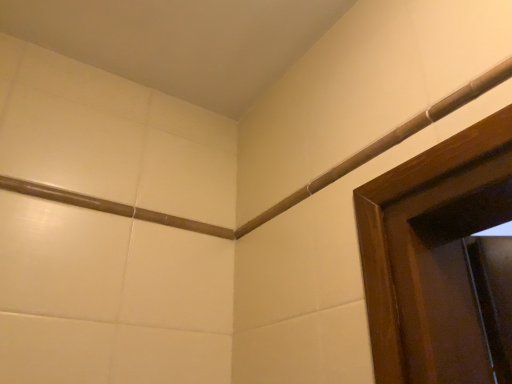
Identify the location of matte wood molding at upper right. This screenshot has height=384, width=512. (387, 141).

This screenshot has height=384, width=512. Describe the element at coordinates (387, 141) in the screenshot. I see `matte wood molding at upper right` at that location.

At what (x,y) coordinates should I click in order to perform the action: click on matte wood molding at upper right. Please return your answer as a coordinate pair (x, y). This screenshot has width=512, height=384. Looking at the image, I should click on (387, 141).